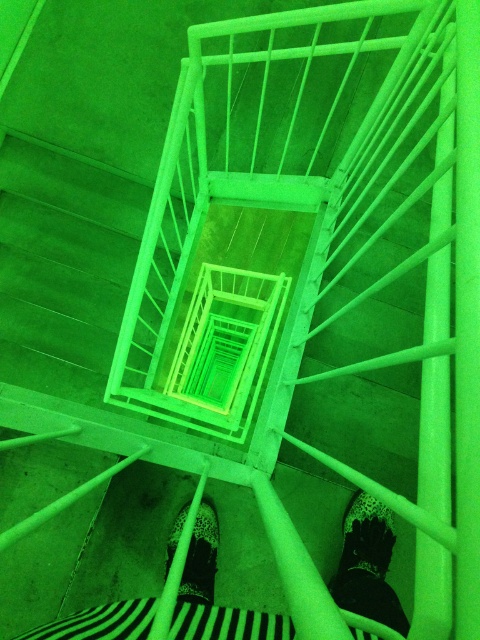
You are standing at the top of a staircase and wearing striped fabric pants at center and a leopard print shoe at center. Which item of clothing is wider?

The striped fabric pants at center might be wider than the leopard print shoe at center according to the description.

You are standing at the top of the staircase in the image. You see a point labeled as point (367, 536). Which object is this point located on?

The point (367, 536) is located on the black matte leather shoe at lower center.

You are standing at the top of the staircase in this green tunnel. You see a point marked at coordinates (368, 564). What is this point located on?

The point at (368, 564) is located on striped fabric pants at center.